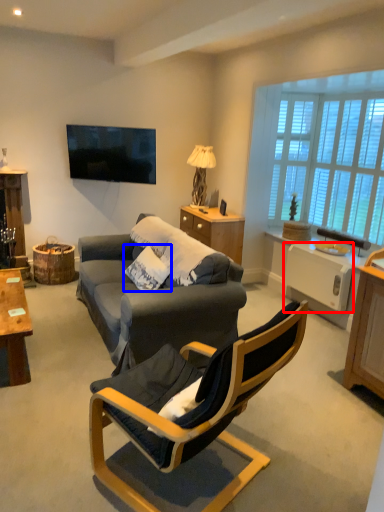
Question: Which of the following is the farthest to the observer, appliance (highlighted by a red box) or pillow (highlighted by a blue box)?

Choices:
 (A) appliance
 (B) pillow

Answer: (A)